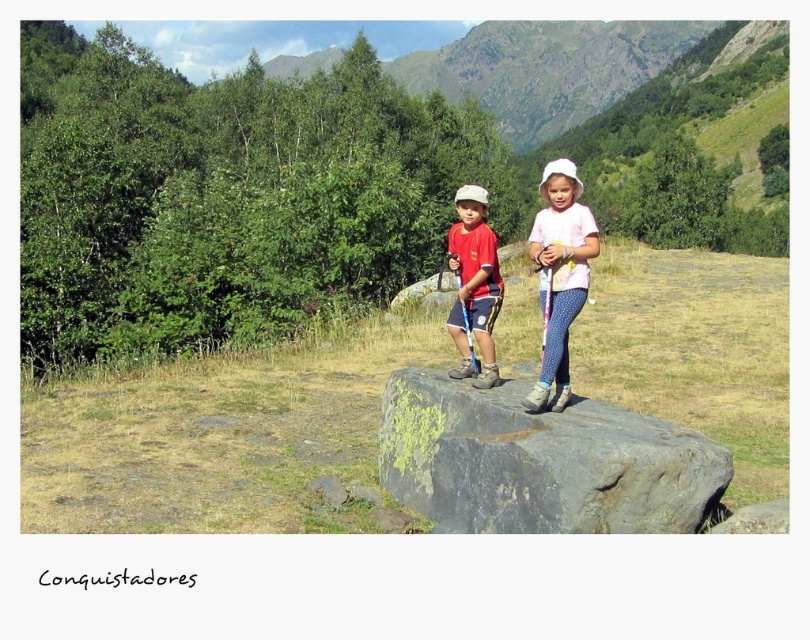
You are a photographer trying to capture a photo of the two children in the scene. You notice the white dotted leggings at center and the matte red shirt at center. Which of these two items appears wider in the photo?

The white dotted leggings at center appears wider than the matte red shirt at center in the photo.

You are a photographer trying to capture a photo of the gray rough boulder at center and the white dotted leggings at center. Based on their sizes, which object should you focus on to ensure it fits entirely within the camera frame?

The gray rough boulder at center has a lesser width compared to white dotted leggings at center, so you should focus on the white dotted leggings at center to ensure it fits entirely within the camera frame since it is wider.

You are a photographer standing 5 feet away from the gray rough boulder at center. You want to take a photo of the white dotted leggings at center without the boulder blocking the view. Is it possible to do so?

The gray rough boulder at center is 4.18 feet away from the white dotted leggings at center. Since you are 5 feet away from the boulder, the total distance from you to the leggings is 5 feet plus 4.18 feet, which is 9.18 feet. Therefore, the boulder will block the view, making it impossible to take the photo without obstruction.